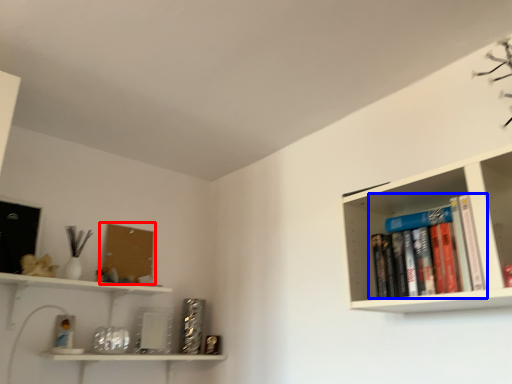
Question: Which of the following is the farthest to the observer, book cover (highlighted by a red box) or book (highlighted by a blue box)?

Choices:
 (A) book cover
 (B) book

Answer: (A)